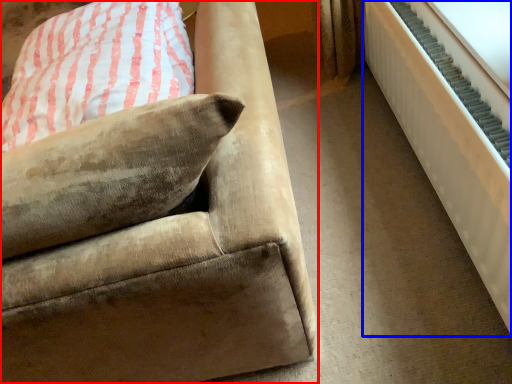
Question: Which of the following is the closest to the observer, studio couch (highlighted by a red box) or radiator (highlighted by a blue box)?

Choices:
 (A) studio couch
 (B) radiator

Answer: (A)